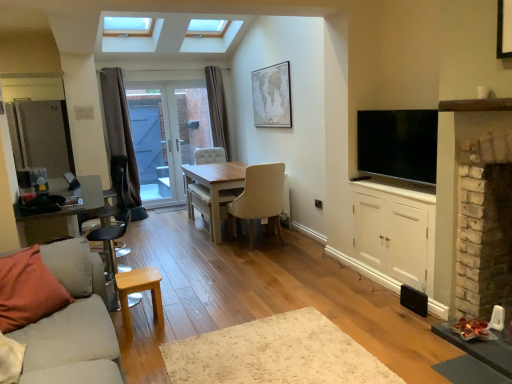
The width and height of the screenshot is (512, 384). I want to click on orange cotton pillow at lower left, so click(x=28, y=290).

Describe the element at coordinates (395, 231) in the screenshot. I see `white wood cabinet at right` at that location.

Where is `light wood stool at lower left`? The image size is (512, 384). light wood stool at lower left is located at coordinates (138, 292).

Is orange cotton pillow at lower left far away from white wood cabinet at right?

Absolutely, orange cotton pillow at lower left is distant from white wood cabinet at right.

Which of these two, orange cotton pillow at lower left or white wood cabinet at right, stands shorter?

orange cotton pillow at lower left.

Which is behind, orange cotton pillow at lower left or white wood cabinet at right?

white wood cabinet at right is further away from the camera.

Can you confirm if white wood cabinet at right is bigger than white shaggy rug at center?

Yes.

From the image's perspective, which is above, white wood cabinet at right or white shaggy rug at center?

white wood cabinet at right.

Can you see white wood cabinet at right touching white shaggy rug at center?

No, white wood cabinet at right is not making contact with white shaggy rug at center.

Which is in front, white wood cabinet at right or white shaggy rug at center?

white shaggy rug at center.

From a real-world perspective, is beige fabric couch at left beneath brown fabric curtain at left, which ranks as the 1th curtain in left-to-right order?

Correct, in the physical world, beige fabric couch at left is lower than brown fabric curtain at left, which ranks as the 1th curtain in left-to-right order.

Can brown fabric curtain at left, which appears as the second curtain when viewed from the back, be found inside beige fabric couch at left?

No.

Looking at this image, considering the sizes of objects beige fabric couch at left and brown fabric curtain at left, which ranks as the 1th curtain in left-to-right order, in the image provided, who is smaller, beige fabric couch at left or brown fabric curtain at left, which ranks as the 1th curtain in left-to-right order,?

Smaller between the two is brown fabric curtain at left, which ranks as the 1th curtain in left-to-right order.

How many degrees apart are the facing directions of beige fabric couch at left and brown fabric curtain at left, which appears as the second curtain when viewed from the back?

beige fabric couch at left and brown fabric curtain at left, which appears as the second curtain when viewed from the back, are facing 91.6 degrees away from each other.

In the scene shown: Could you tell me if flat screen tv at right is turned towards brown velvet curtain at center, the first curtain positioned from the right?

No, flat screen tv at right is not turned towards brown velvet curtain at center, the first curtain positioned from the right.

From the image's perspective, between flat screen tv at right and brown velvet curtain at center, the first curtain viewed from the back, who is located below?

flat screen tv at right is shown below in the image.

Looking at their sizes, would you say flat screen tv at right is wider or thinner than brown velvet curtain at center, the first curtain viewed from the back?

Clearly, flat screen tv at right has less width compared to brown velvet curtain at center, the first curtain viewed from the back.

Does point (413, 138) come farther from viewer compared to point (212, 107)?

No, (413, 138) is in front of (212, 107).

Is the surface of brown velvet curtain at center, the first curtain viewed from the back, in direct contact with beige textured map at upper center?

brown velvet curtain at center, the first curtain viewed from the back, is not next to beige textured map at upper center, and they're not touching.

From the picture: In terms of width, does brown velvet curtain at center, the second curtain in the front-to-back sequence, look wider or thinner when compared to beige textured map at upper center?

Clearly, brown velvet curtain at center, the second curtain in the front-to-back sequence, has more width compared to beige textured map at upper center.

In the scene shown: Who is shorter, brown velvet curtain at center, which appears as the 2th curtain when viewed from the left, or beige textured map at upper center?

beige textured map at upper center.

Is brown velvet curtain at center, which appears as the 2th curtain when viewed from the left, to the left or to the right of beige textured map at upper center in the image?

In the image, brown velvet curtain at center, which appears as the 2th curtain when viewed from the left, appears on the left side of beige textured map at upper center.

Considering the positions of points (109, 305) and (119, 354), is point (109, 305) farther from camera compared to point (119, 354)?

Yes.

I want to click on armchair that is the 1st object located above the beige fabric couch at left (from the image's perspective), so click(111, 247).

How different are the orientations of metallic silver barstool at left, the 1th armchair from the right, and beige fabric couch at left in degrees?

The angular difference between metallic silver barstool at left, the 1th armchair from the right, and beige fabric couch at left is 176 degrees.

Can you confirm if metallic silver barstool at left, which is the first armchair in front-to-back order, is shorter than beige fabric couch at left?

Correct, metallic silver barstool at left, which is the first armchair in front-to-back order, is not as tall as beige fabric couch at left.

Considering the relative sizes of brown fabric curtain at left, which is the second curtain from right to left, and beige fabric chair at center, which appears as the first chair when viewed from the right, in the image provided, is brown fabric curtain at left, which is the second curtain from right to left, smaller than beige fabric chair at center, which appears as the first chair when viewed from the right,?

Yes.

From the image's perspective, which one is positioned lower, brown fabric curtain at left, which ranks as the 1th curtain in front-to-back order, or beige fabric chair at center, which appears as the first chair when viewed from the right?

beige fabric chair at center, which appears as the first chair when viewed from the right, is shown below in the image.

Is the depth of brown fabric curtain at left, which ranks as the 1th curtain in front-to-back order, greater than that of beige fabric chair at center, the second chair positioned from the left?

Yes, brown fabric curtain at left, which ranks as the 1th curtain in front-to-back order, is further from the camera.

Does brown fabric curtain at left, which appears as the second curtain when viewed from the back, turn towards beige fabric chair at center, which appears as the first chair when viewed from the right?

No, brown fabric curtain at left, which appears as the second curtain when viewed from the back, does not turn towards beige fabric chair at center, which appears as the first chair when viewed from the right.

Locate an element on the screen. The image size is (512, 384). pillow lying on the left of white wood cabinet at right is located at coordinates (28, 290).

Locate an element on the screen. This screenshot has height=384, width=512. plain below the white wood cabinet at right (from a real-world perspective) is located at coordinates (275, 354).

Looking at the image, which one is located closer to white glossy door at center, brown fabric curtain at left, which is the second curtain from right to left, or flat screen tv at right?

Among the two, brown fabric curtain at left, which is the second curtain from right to left, is located nearer to white glossy door at center.

From the image, which object appears to be farther from light beige fabric chair at center, marked as the first chair in a left-to-right arrangement, black leather armchair at left, the first armchair from the left, or beige textured map at upper center?

black leather armchair at left, the first armchair from the left, is further to light beige fabric chair at center, marked as the first chair in a left-to-right arrangement.

Estimate the real-world distances between objects in this image. Which object is further from light wood stool at lower left, metallic silver barstool at left, the 1th armchair from the right, or orange cotton pillow at lower left?

metallic silver barstool at left, the 1th armchair from the right, lies further to light wood stool at lower left than the other object.

Estimate the real-world distances between objects in this image. Which object is closer to white glossy door at center, orange cotton pillow at lower left or white wood cabinet at right?

Based on the image, white wood cabinet at right appears to be nearer to white glossy door at center.

From the image, which object appears to be nearer to brown velvet curtain at center, the second curtain in the front-to-back sequence, beige fabric chair at center, which appears as the first chair when viewed from the right, or brick fireplace at right?

beige fabric chair at center, which appears as the first chair when viewed from the right, lies closer to brown velvet curtain at center, the second curtain in the front-to-back sequence, than the other object.

Based on the photo, considering their positions, is light wood stool at lower left positioned further to black leather armchair at left, which ranks as the first armchair in back-to-front order, than metallic silver barstool at left, which is counted as the 2th armchair, starting from the left?

The object further to black leather armchair at left, which ranks as the first armchair in back-to-front order, is light wood stool at lower left.

Based on their spatial positions, is orange cotton pillow at lower left or beige fabric chair at center, which appears as the first chair when viewed from the right, further from beige textured map at upper center?

orange cotton pillow at lower left.

Based on the photo, estimate the real-world distances between objects in this image. Which object is closer to black leather armchair at left, arranged as the 2th armchair when viewed from the right, orange cotton pillow at lower left or white shaggy rug at center?

orange cotton pillow at lower left is closer to black leather armchair at left, arranged as the 2th armchair when viewed from the right.

Where is `cabinetry between beige fabric couch at left and beige textured map at upper center along the z-axis`? The width and height of the screenshot is (512, 384). cabinetry between beige fabric couch at left and beige textured map at upper center along the z-axis is located at coordinates (395, 231).

Image resolution: width=512 pixels, height=384 pixels. In order to click on picture frame located between white wood cabinet at right and white glossy door at center in the depth direction in this screenshot , I will do `click(272, 96)`.

Where is `television situated between brown fabric curtain at left, which ranks as the 1th curtain in left-to-right order, and white wood cabinet at right from left to right`? The height and width of the screenshot is (384, 512). television situated between brown fabric curtain at left, which ranks as the 1th curtain in left-to-right order, and white wood cabinet at right from left to right is located at coordinates (398, 144).

The width and height of the screenshot is (512, 384). Find the location of `curtain situated between brown fabric curtain at left, which ranks as the 1th curtain in left-to-right order, and beige textured map at upper center from left to right`. curtain situated between brown fabric curtain at left, which ranks as the 1th curtain in left-to-right order, and beige textured map at upper center from left to right is located at coordinates (217, 109).